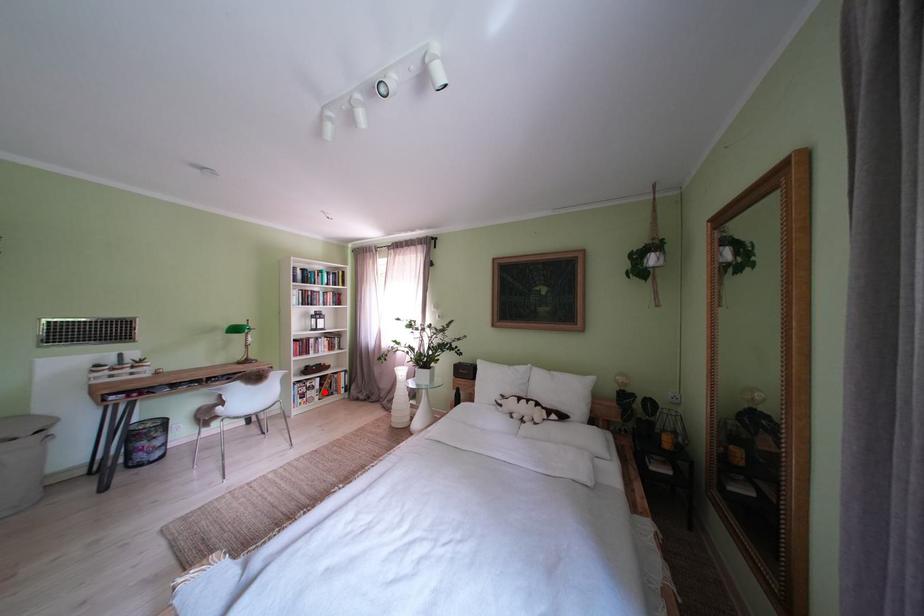
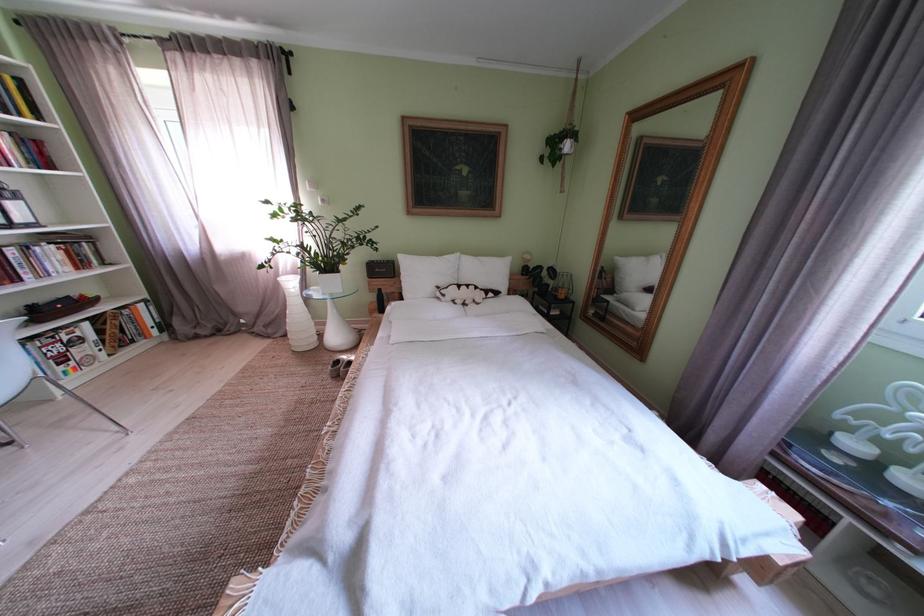
The point at the highlighted location is marked in the first image. Where is the corresponding point in the second image?

(92, 344)